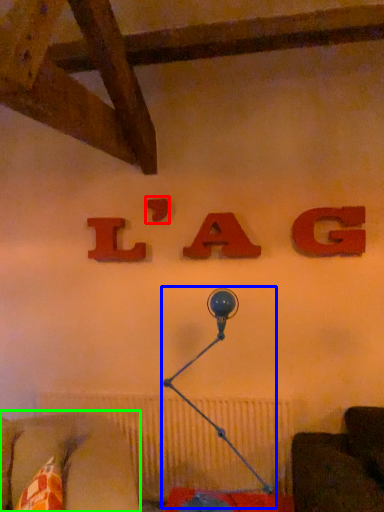
Question: Based on their relative distances, which object is farther from alphabet (highlighted by a red box)? Choose from table lamp (highlighted by a blue box) and furniture (highlighted by a green box).

Choices:
 (A) table lamp
 (B) furniture

Answer: (B)